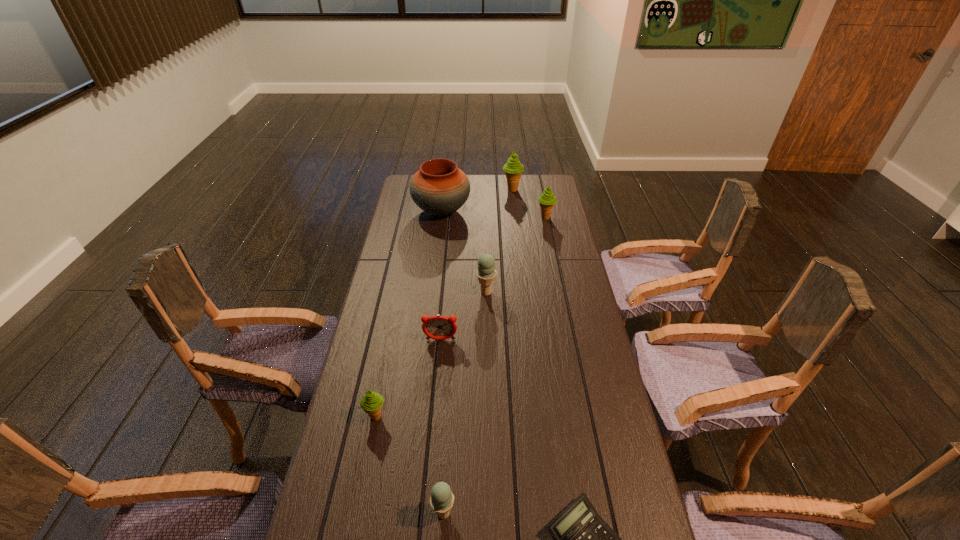
Image resolution: width=960 pixels, height=540 pixels. I want to click on vacant area between the smallest green icecream and the fifth farthest object, so click(x=408, y=378).

You are a GUI agent. You are given a task and a screenshot of the screen. Output one action in this format:
    pyautogui.click(x=<x>, y=<y>)
    Task: Click on the free space between the farthest ice cream and the nearest ice cream
    
    Given the screenshot: What is the action you would take?
    pyautogui.click(x=478, y=352)

Locate an element on the screen. The height and width of the screenshot is (540, 960). vacant space that is in between the pottery and the second nearest ice cream is located at coordinates (409, 314).

Identify the location of vacant point located between the farthest ice cream and the rightmost ice cream. (529, 204).

Locate an element on the screen. This screenshot has height=540, width=960. empty space that is in between the fifth object from left to right and the pottery is located at coordinates (464, 252).

Where is `free space that is in between the smallest green icecream and the red pottery`? The width and height of the screenshot is (960, 540). free space that is in between the smallest green icecream and the red pottery is located at coordinates (409, 314).

Where is `free area in between the fourth ice cream from right to left and the red pottery`? The height and width of the screenshot is (540, 960). free area in between the fourth ice cream from right to left and the red pottery is located at coordinates (443, 362).

Choose which object is the second nearest neighbor to the leftmost green icecream. Please provide its 2D coordinates. Your answer should be formatted as a tuple, i.e. [(x, y)], where the tuple contains the x and y coordinates of a point satisfying the conditions above.

[(437, 327)]

Identify which object is located as the second nearest to the bigger blue ice cream. Please provide its 2D coordinates. Your answer should be formatted as a tuple, i.e. [(x, y)], where the tuple contains the x and y coordinates of a point satisfying the conditions above.

[(440, 188)]

The image size is (960, 540). Find the location of `the fourth closest ice cream to the nearer blue ice cream`. the fourth closest ice cream to the nearer blue ice cream is located at coordinates (513, 169).